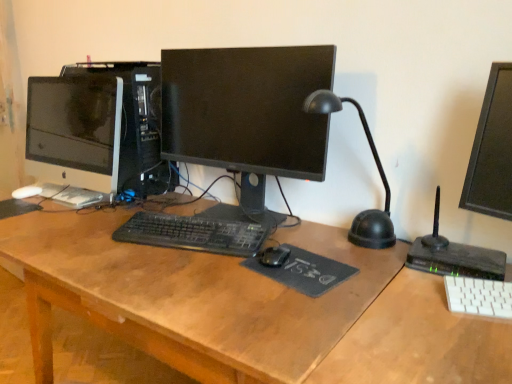
Locate an element on the screen. free space between white glossy monitor at left, acting as the second computer monitor starting from the right, and black rubber mousepad at center, which ranks as the first mousepad in back-to-front order is located at coordinates (53, 213).